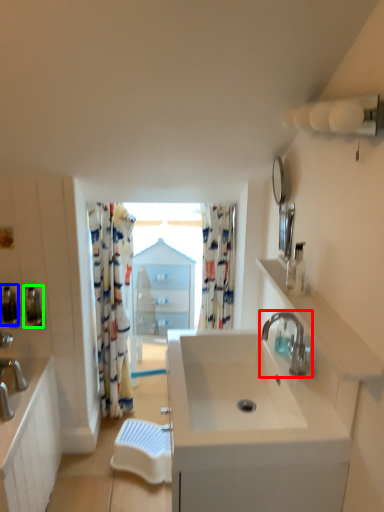
Question: Which is nearer to the tap (highlighted by a red box)? soap dispenser (highlighted by a blue box) or soap dispenser (highlighted by a green box).

Choices:
 (A) soap dispenser
 (B) soap dispenser

Answer: (B)